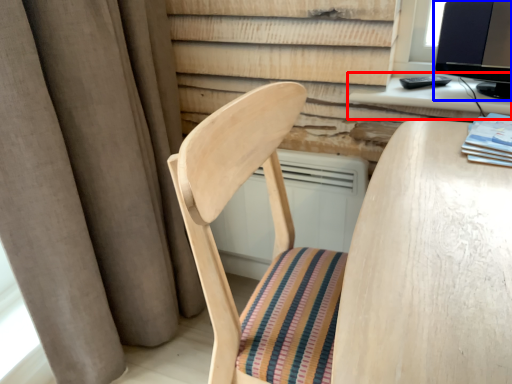
Question: Which object appears closest to the camera in this image, computer desk (highlighted by a red box) or computer monitor (highlighted by a blue box)?

Choices:
 (A) computer desk
 (B) computer monitor

Answer: (B)